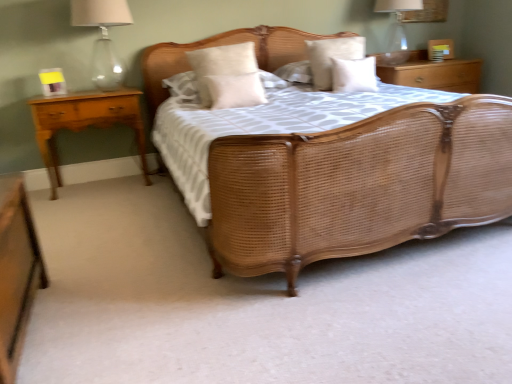
Where is `vacant space that is in between woven wood bed at center and light brown wood nightstand at left, which is the second nightstand from front to back`? vacant space that is in between woven wood bed at center and light brown wood nightstand at left, which is the second nightstand from front to back is located at coordinates (145, 225).